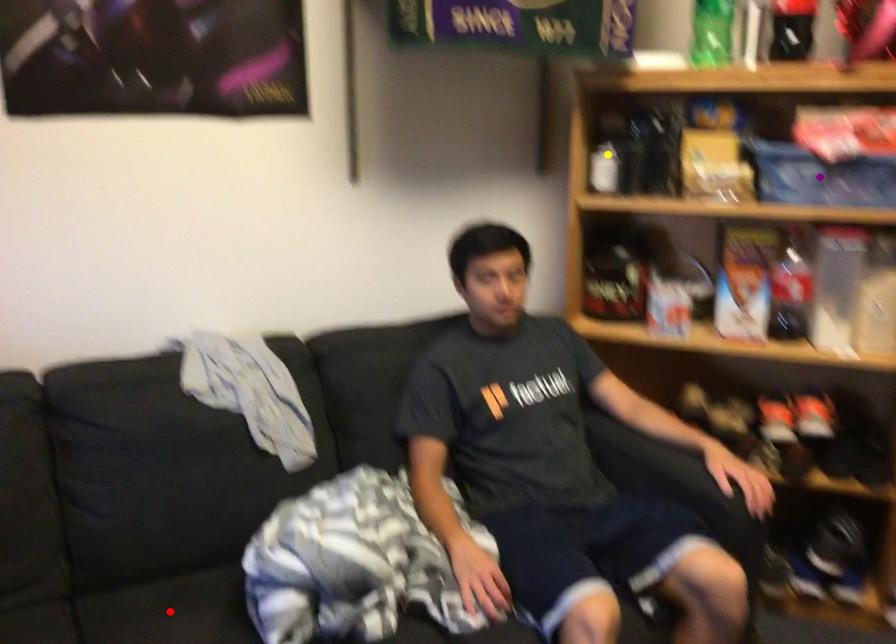
Order these from nearest to farthest:
1. purple point
2. yellow point
3. red point

1. red point
2. purple point
3. yellow point